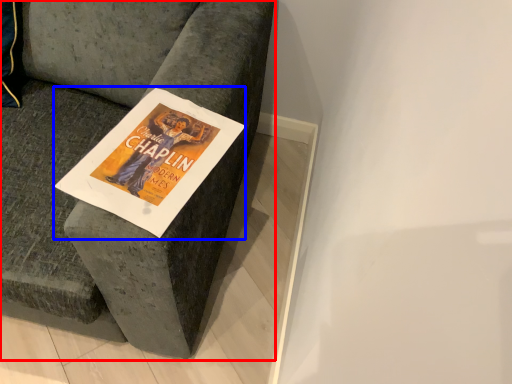
Question: Which object appears closest to the camera in this image, furniture (highlighted by a red box) or magazine (highlighted by a blue box)?

Choices:
 (A) furniture
 (B) magazine

Answer: (A)